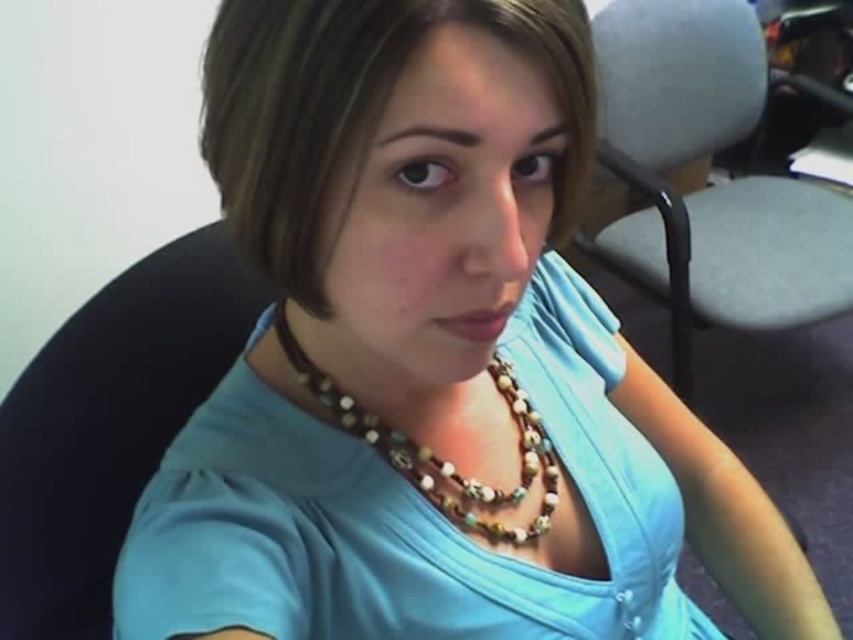
You are organizing a small event and need to seat guests. You have a gray fabric swivel chair at right and a brown beaded necklace at center. Which object is taller and would be suitable for placing a decorative centerpiece on top?

The gray fabric swivel chair at right is taller than the brown beaded necklace at center, so it would be suitable for placing a decorative centerpiece on top.

You are standing in the office and want to place a small plant between the two points labeled point (701, 60) and point (498, 506). Which point should the plant be closer to in order to be closer to the camera?

The plant should be closer to point (701, 60) because it is further to the camera than point (498, 506).

You are standing in an office and want to sit down. There is a gray fabric swivel chair at right. Can you estimate its location based on the room layout?

The gray fabric swivel chair at right is located at coordinates point 0.292 on the x axis and 0.836 on the y axis.